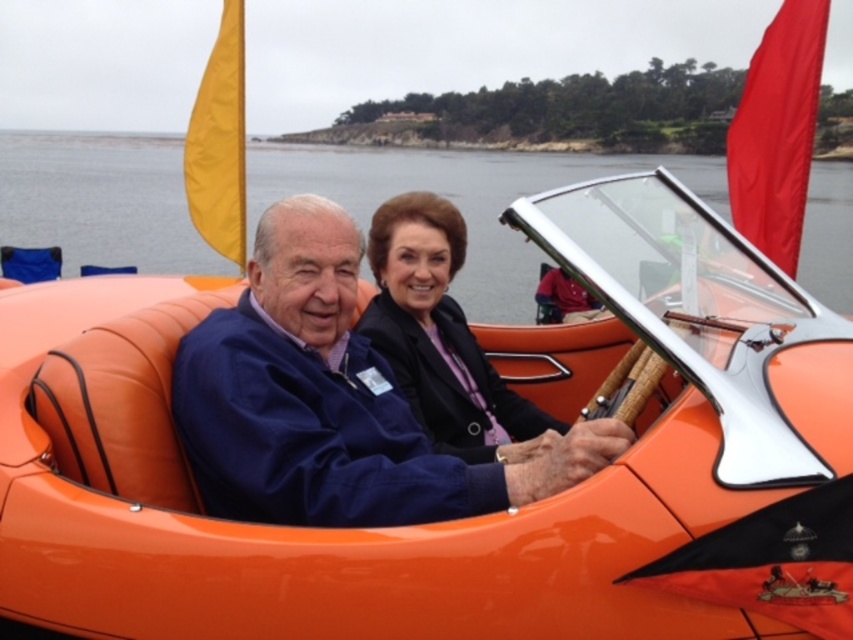
Question: Is orange leather water at center positioned at the back of matte black jacket at center?

Choices:
 (A) yes
 (B) no

Answer: (A)

Question: Which object is farther from the camera taking this photo?

Choices:
 (A) matte blue jacket at center
 (B) orange leather water at center
 (C) matte black jacket at center

Answer: (B)

Question: Is matte blue jacket at center to the left of matte black jacket at center from the viewer's perspective?

Choices:
 (A) yes
 (B) no

Answer: (A)

Question: Does matte blue jacket at center have a larger size compared to orange leather water at center?

Choices:
 (A) no
 (B) yes

Answer: (A)

Question: Which point is farther to the camera?

Choices:
 (A) (254, 177)
 (B) (410, 252)
 (C) (399, 454)

Answer: (A)

Question: Which of the following is the closest to the observer?

Choices:
 (A) (480, 364)
 (B) (820, 244)
 (C) (305, 244)

Answer: (C)